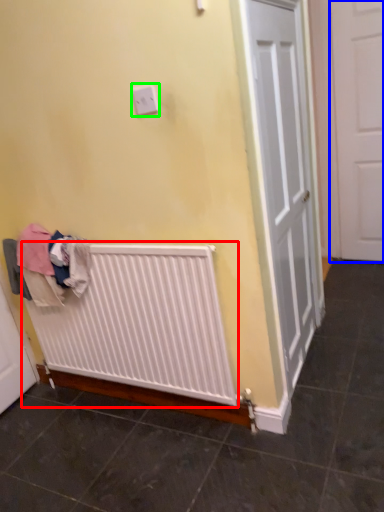
Question: Considering the real-world distances, which object is closest to radiator (highlighted by a red box)? door (highlighted by a blue box) or electric outlet (highlighted by a green box).

Choices:
 (A) door
 (B) electric outlet

Answer: (B)